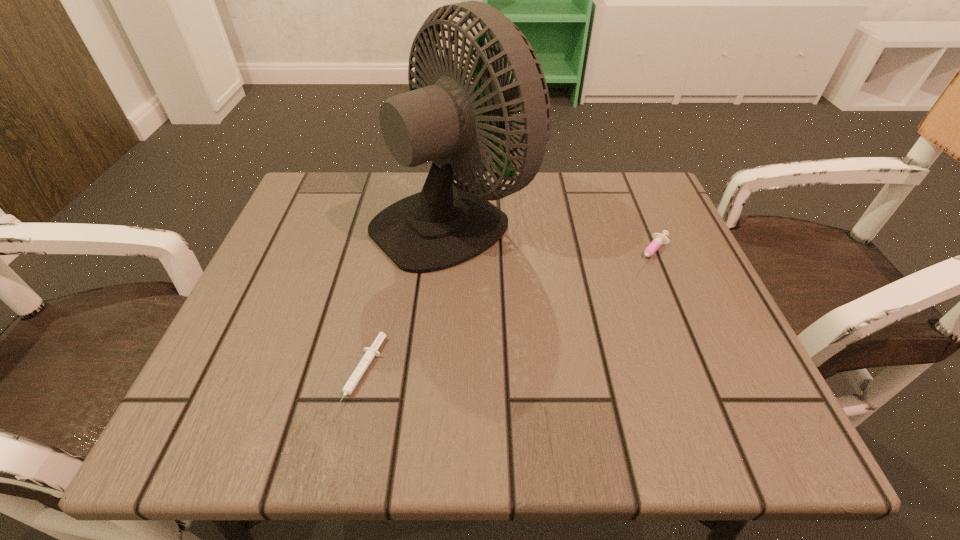
Image resolution: width=960 pixels, height=540 pixels. I want to click on object located at the right edge, so click(x=658, y=239).

The image size is (960, 540). What are the coordinates of `vacant space at the far edge` in the screenshot? It's located at (423, 171).

This screenshot has width=960, height=540. I want to click on free space at the near edge of the desktop, so tap(450, 428).

Find the location of a particular element. The image size is (960, 540). free space at the left edge is located at coordinates (235, 375).

Find the location of a particular element. vacant space at the right edge of the desktop is located at coordinates (676, 237).

Identify the location of free space at the far left corner of the desktop. The height and width of the screenshot is (540, 960). (349, 210).

In the image, there is a desktop. Identify the location of vacant space at the near left corner. The width and height of the screenshot is (960, 540). (297, 420).

Where is `vacant space at the far right corner`? vacant space at the far right corner is located at coordinates (607, 226).

In order to click on unoccupied position between the tallest object and the farther syringe in this screenshot , I will do [552, 235].

At what (x,y) coordinates should I click in order to perform the action: click on free spot between the second shortest object and the left syringe. Please return your answer as a coordinate pair (x, y). Looking at the image, I should click on (506, 314).